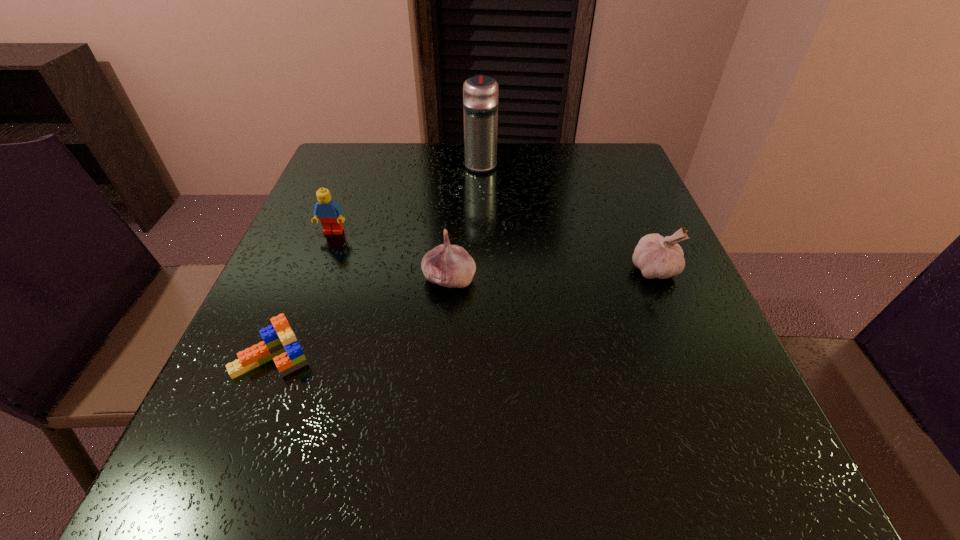
Locate an element on the screen. The width and height of the screenshot is (960, 540). free space located 0.370m on the front of the rightmost object is located at coordinates (748, 497).

Where is `free space located on the face of the farther Lego`? The height and width of the screenshot is (540, 960). free space located on the face of the farther Lego is located at coordinates (276, 380).

This screenshot has width=960, height=540. I want to click on vacant space positioned 0.210m on the right of the shorter Lego, so click(x=442, y=358).

I want to click on object present at the far edge, so click(480, 93).

At what (x,y) coordinates should I click in order to perform the action: click on object situated at the right edge. Please return your answer as a coordinate pair (x, y). This screenshot has width=960, height=540. Looking at the image, I should click on (657, 257).

Find the location of a particular element. Image resolution: width=960 pixels, height=540 pixels. vacant space at the far edge is located at coordinates (457, 157).

Image resolution: width=960 pixels, height=540 pixels. Find the location of `vacant space at the near edge of the desktop`. vacant space at the near edge of the desktop is located at coordinates (427, 465).

Locate an element on the screen. The image size is (960, 540). vacant region at the left edge of the desktop is located at coordinates (304, 258).

Where is `vacant area at the right edge`? The image size is (960, 540). vacant area at the right edge is located at coordinates (709, 403).

At what (x,y) coordinates should I click in order to perform the action: click on free location at the far left corner. Please return your answer as a coordinate pair (x, y). The height and width of the screenshot is (540, 960). Looking at the image, I should click on (363, 184).